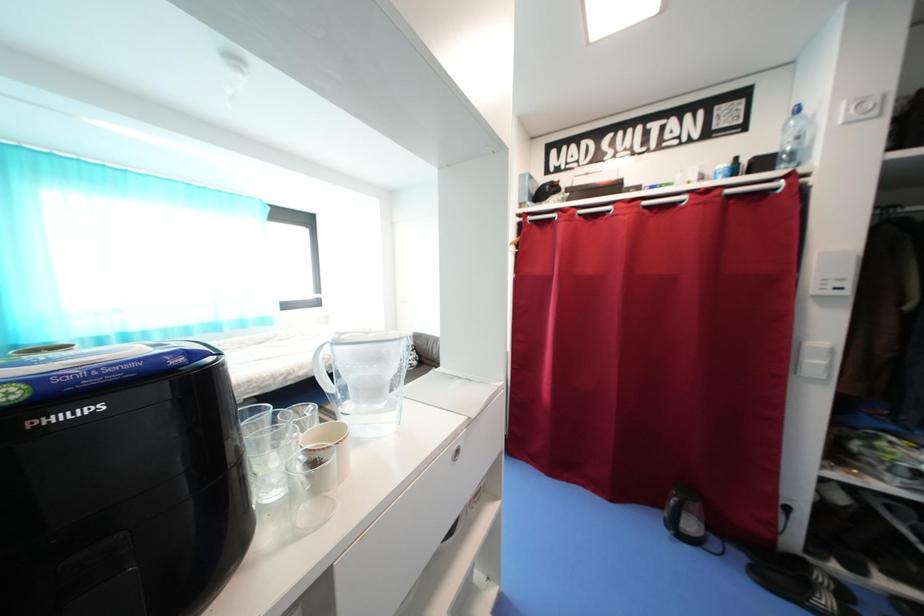
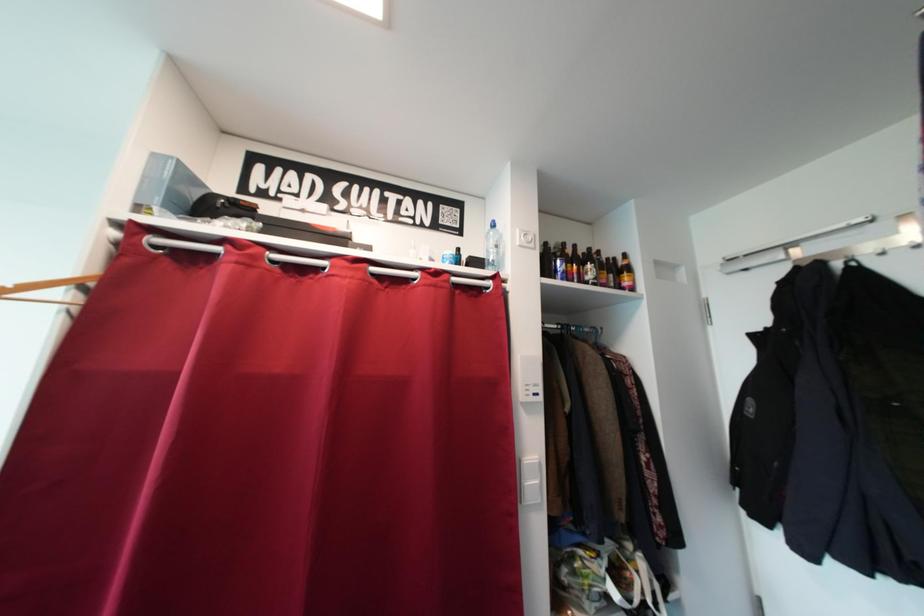
From the picture: Based on the continuous images, in which direction is the camera rotating?

The camera rotated toward right-up.